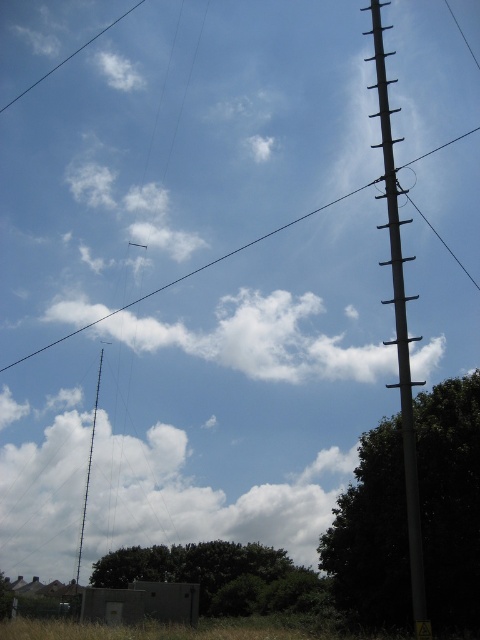
You are a painter standing at the base of the green leafy tree at right. You want to paint the smooth gray pole at right. Can you walk directly to the pole without moving around any obstacles? Explain your reasoning based on the distance provided.

The distance between the green leafy tree at right and the smooth gray pole at right is 8.82 meters. Since there are no obstacles mentioned in the scene description, you can walk directly to the pole without any hindrance.

You are standing at the center of the image and looking towards the right side. There is a point marked at coordinates point (399, 324). Which structure is this point located on?

A: The point (399, 324) is on the smooth gray pole at right.

You are standing in a park and see the green leafy tree at right and the smooth gray pole at right. Which object is closer to you?

The green leafy tree at right is closer to you because it is further to the viewer than the smooth gray pole at right.